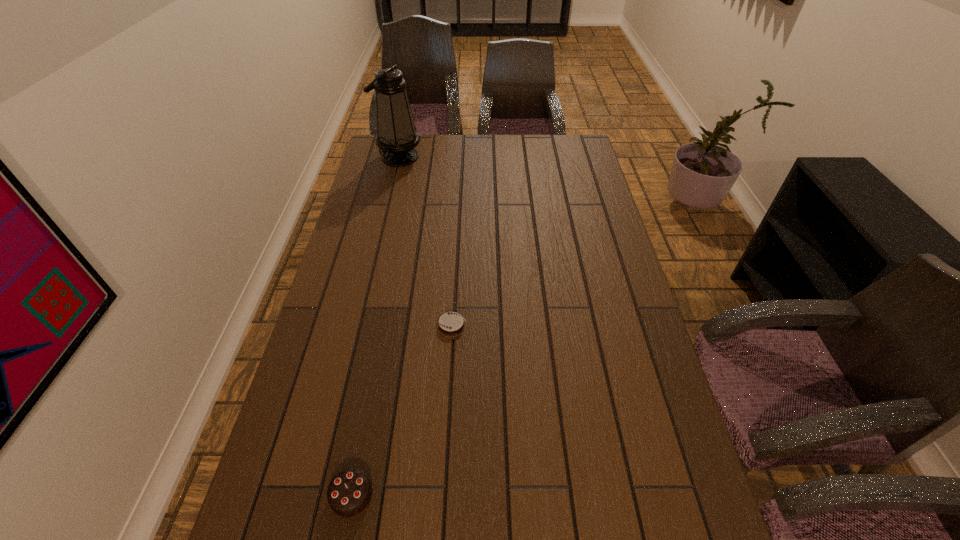
This screenshot has height=540, width=960. What are the coordinates of `empty space between the taller chocolate cake and the rightmost object` in the screenshot? It's located at (401, 410).

The image size is (960, 540). What are the coordinates of `vacant area that lies between the nearest object and the farthest object` in the screenshot? It's located at (375, 326).

Image resolution: width=960 pixels, height=540 pixels. Find the location of `vacant space in between the second tallest object and the second farthest object`. vacant space in between the second tallest object and the second farthest object is located at coordinates (401, 410).

Where is `free space between the nearest object and the farther chocolate cake`? free space between the nearest object and the farther chocolate cake is located at coordinates (401, 410).

Identify the location of vacant point located between the rightmost object and the oil lamp. This screenshot has height=540, width=960. (425, 241).

What are the coordinates of `blank region between the farthest object and the second farthest object` in the screenshot? It's located at click(425, 241).

The image size is (960, 540). In order to click on vacant space in between the farthest object and the nearer chocolate cake in this screenshot , I will do `click(375, 326)`.

This screenshot has width=960, height=540. In order to click on free space between the shortest object and the second tallest object in this screenshot , I will do `click(401, 410)`.

The width and height of the screenshot is (960, 540). Identify the location of object that is the second closest one to the shortest object. (397, 137).

This screenshot has height=540, width=960. I want to click on object that is the closest to the oil lamp, so click(x=451, y=324).